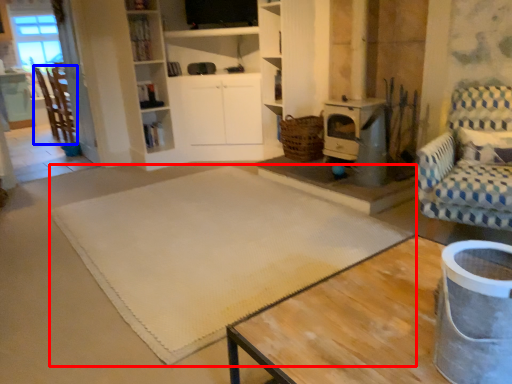
Question: Which of the following is the farthest to the observer, mat (highlighted by a red box) or chair (highlighted by a blue box)?

Choices:
 (A) mat
 (B) chair

Answer: (B)